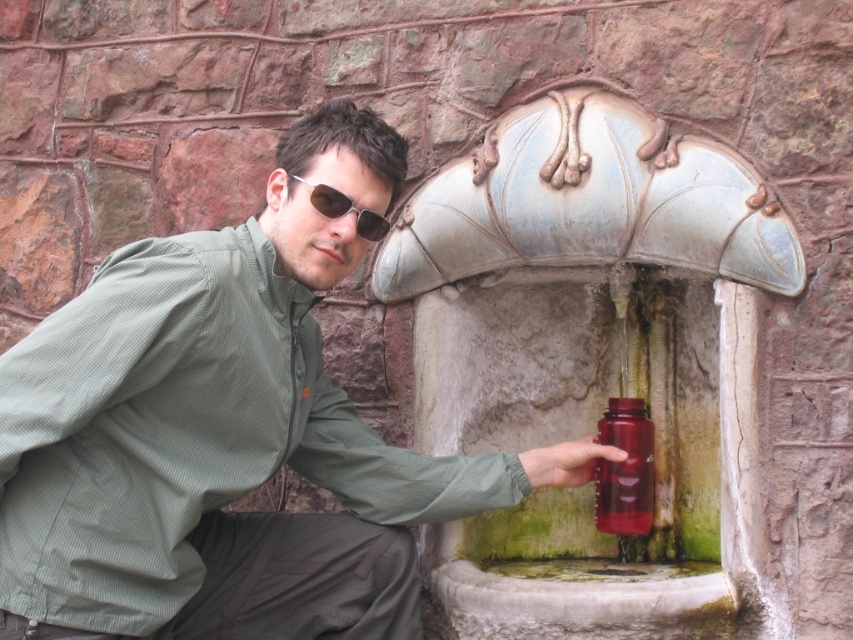
Question: Observing the image, what is the correct spatial positioning of olive green fabric shirt at center in reference to translucent red bottle at lower center?

Choices:
 (A) left
 (B) right

Answer: (A)

Question: Which point is farther to the camera?

Choices:
 (A) (294, 176)
 (B) (608, 426)
 (C) (120, 502)

Answer: (B)

Question: Is olive green fabric shirt at center thinner than translucent red bottle at lower center?

Choices:
 (A) yes
 (B) no

Answer: (B)

Question: Which of the following is the farthest from the observer?

Choices:
 (A) (340, 211)
 (B) (624, 403)

Answer: (B)

Question: Does olive green fabric shirt at center appear on the left side of translucent red bottle at lower center?

Choices:
 (A) no
 (B) yes

Answer: (B)

Question: Which object appears closest to the camera in this image?

Choices:
 (A) sunglasses at center
 (B) olive green fabric shirt at center
 (C) translucent red bottle at lower center

Answer: (B)